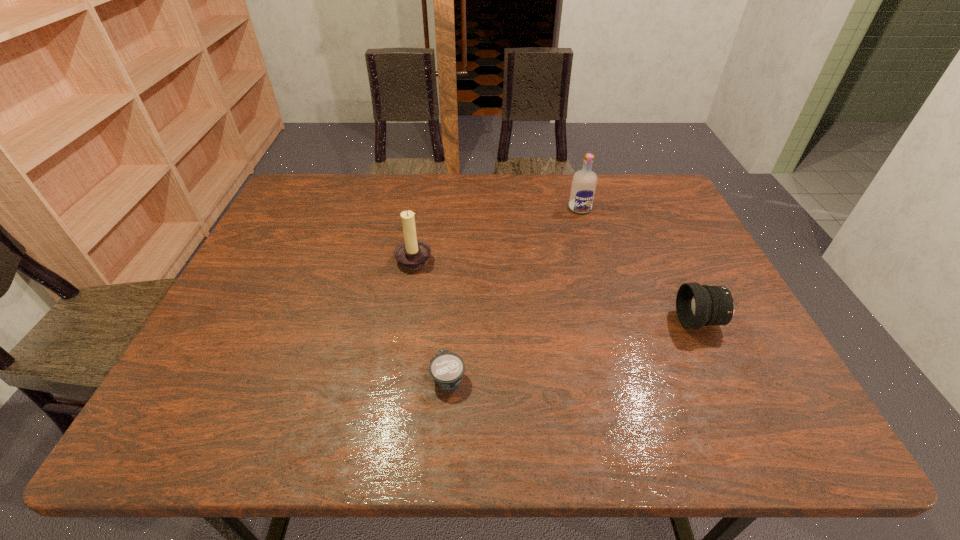
Locate an element on the screen. The height and width of the screenshot is (540, 960). free location located at the front element of the second nearest object is located at coordinates (609, 321).

You are a GUI agent. You are given a task and a screenshot of the screen. Output one action in this format:
    pyautogui.click(x=<x>, y=<y>)
    Task: Click on the vacant area situated at the front element of the second nearest object
    
    Given the screenshot: What is the action you would take?
    pyautogui.click(x=631, y=321)

Locate an element on the screen. The height and width of the screenshot is (540, 960). vacant space situated at the front element of the second nearest object is located at coordinates (613, 321).

Where is `vacant area situated 0.290m on the back of the third object from right to left`? vacant area situated 0.290m on the back of the third object from right to left is located at coordinates (455, 269).

At what (x,y) coordinates should I click in order to perform the action: click on object located at the far edge. Please return your answer as a coordinate pair (x, y). The height and width of the screenshot is (540, 960). Looking at the image, I should click on (584, 182).

This screenshot has height=540, width=960. In order to click on object located at the right edge in this screenshot , I will do `click(697, 305)`.

The width and height of the screenshot is (960, 540). I want to click on vacant region at the far edge, so click(x=498, y=204).

This screenshot has height=540, width=960. I want to click on vacant space at the near edge of the desktop, so click(x=322, y=444).

In the image, there is a desktop. Where is `vacant space at the left edge`? vacant space at the left edge is located at coordinates (266, 232).

The width and height of the screenshot is (960, 540). In the image, there is a desktop. What are the coordinates of `free space at the right edge` in the screenshot? It's located at (712, 399).